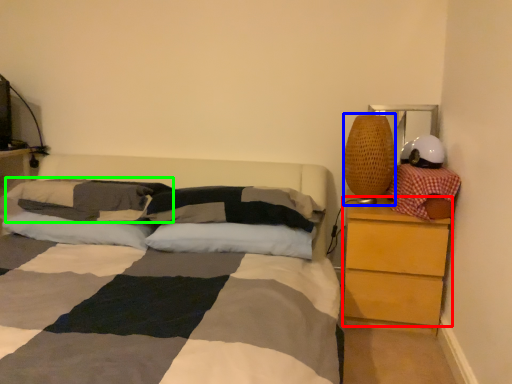
Question: Which object is positioned farthest from chest of drawers (highlighted by a red box)? Select from table lamp (highlighted by a blue box) and pillow (highlighted by a green box).

Choices:
 (A) table lamp
 (B) pillow

Answer: (B)